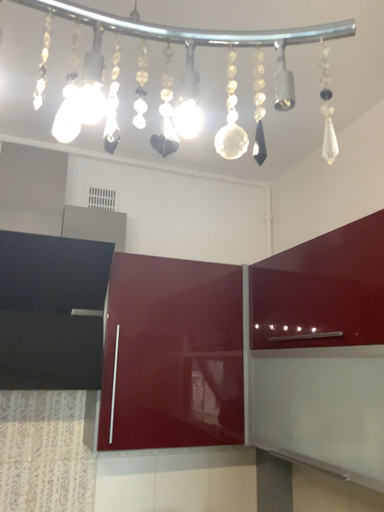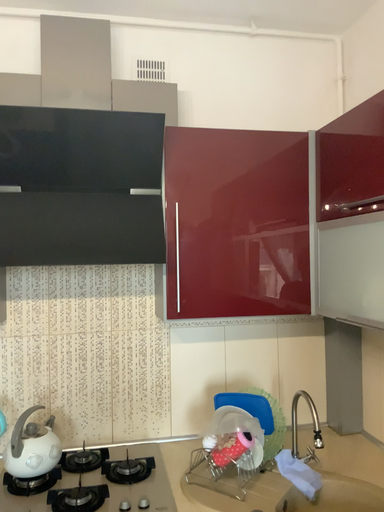
Question: How did the camera likely rotate when shooting the video?

Choices:
 (A) rotated left
 (B) rotated right

Answer: (A)